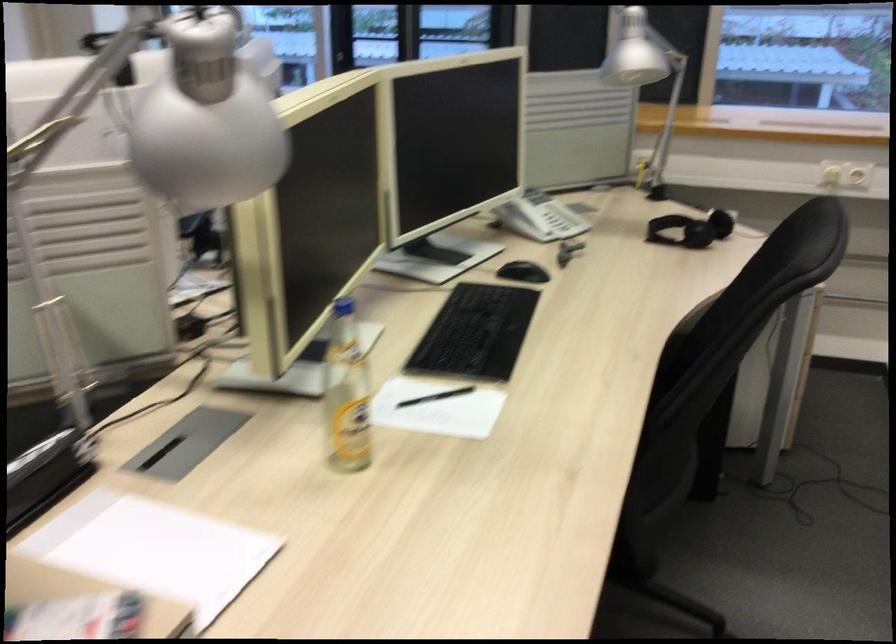
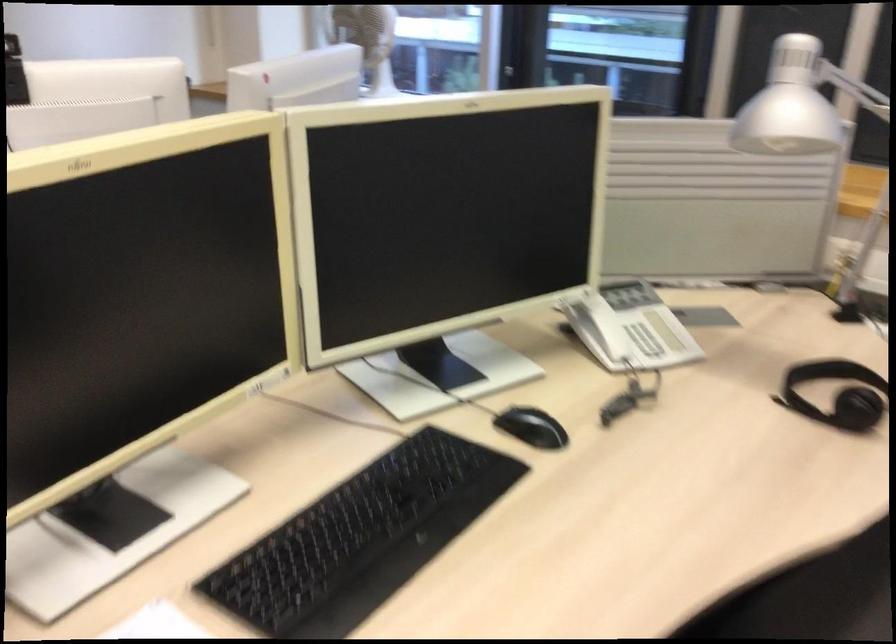
Find the pixel in the second image that matches (530,270) in the first image.

(531, 427)